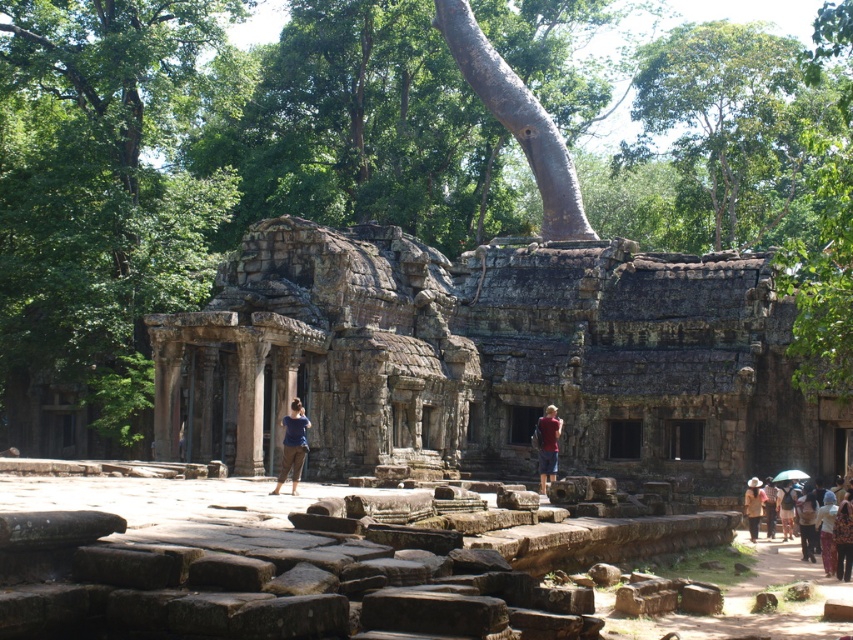
Is gray stone temple at center closer to the viewer compared to green leafy tree at upper center?

No, it is behind green leafy tree at upper center.

Can you confirm if gray stone temple at center is positioned to the left of green leafy tree at upper center?

Indeed, gray stone temple at center is positioned on the left side of green leafy tree at upper center.

Between point (450, 273) and point (781, 97), which one is positioned behind?

The point (781, 97) is more distant.

The image size is (853, 640). What are the coordinates of `gray stone temple at center` in the screenshot? It's located at (x=489, y=358).

Which is below, green leafy tree at upper center or brown textured hat at center?

Positioned lower is brown textured hat at center.

Which of these two, green leafy tree at upper center or brown textured hat at center, stands taller?

green leafy tree at upper center is taller.

Locate an element on the screen. The height and width of the screenshot is (640, 853). green leafy tree at upper center is located at coordinates (734, 125).

Is point (401, 349) farther from camera compared to point (807, 508)?

Yes.

From the picture: Between gray stone temple at center and brown textured dress at lower right, which one is positioned higher?

gray stone temple at center is higher up.

Who is more distant from viewer, (177, 321) or (802, 529)?

The point (177, 321) is more distant.

Where is `gray stone temple at center`? The image size is (853, 640). gray stone temple at center is located at coordinates (489, 358).